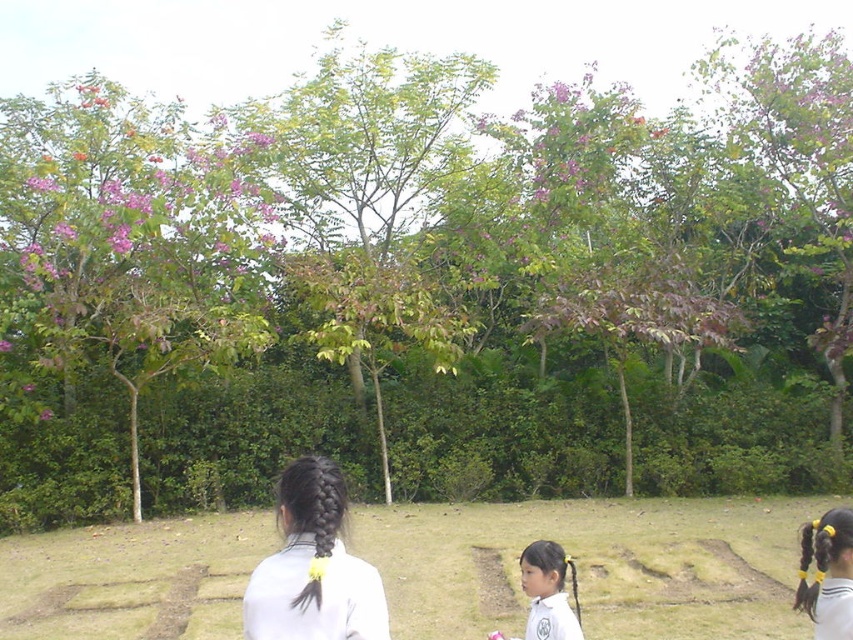
Does pink flowered tree at upper left come behind black hair at lower right?

Yes, pink flowered tree at upper left is further from the viewer.

Can you confirm if pink flowered tree at upper left is wider than black hair at lower right?

Yes.

Image resolution: width=853 pixels, height=640 pixels. Identify the location of pink flowered tree at upper left. (131, 236).

Find the location of a particular element. The image size is (853, 640). pink flowered tree at upper left is located at coordinates (131, 236).

Is black hair at lower right positioned in front of pink silky flower at upper left?

Yes, it is.

Image resolution: width=853 pixels, height=640 pixels. Find the location of `black hair at lower right`. black hair at lower right is located at coordinates (827, 573).

Who is more forward, (817,600) or (53,189)?

Point (817,600)

Find the location of `black hair at lower right`. black hair at lower right is located at coordinates (827, 573).

Is point (212, 272) closer to viewer compared to point (322, 593)?

That is False.

Can you confirm if pink flowered tree at upper left is taller than black hair at center?

In fact, pink flowered tree at upper left may be shorter than black hair at center.

Measure the distance between pink flowered tree at upper left and camera.

pink flowered tree at upper left and camera are 11.84 meters apart from each other.

This screenshot has height=640, width=853. In order to click on pink flowered tree at upper left in this screenshot , I will do `click(131, 236)`.